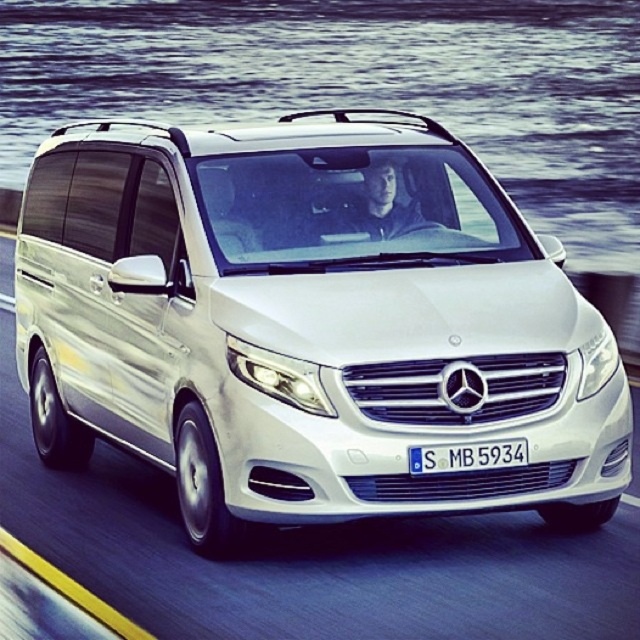
You are a photographer trying to capture both the white metallic van at center and the white matte van at center in a single shot. Since you want them to be clearly visible, you need to know their positions relative to each other. Which van is located to the left of the other?

The white metallic van at center is positioned on the left side of white matte van at center.

You are a photographer standing at the point with coordinates (307, 326) in the scene. What object is exactly at your current position?

The white metallic van at center is exactly at the point with coordinates (307, 326).

You are a driver in the white matte van at center. You notice clear water at center ahead on the road. Is there a risk of hydroplaning? Please explain based on the scene description.

The clear water at center is located above the white matte van at center, meaning it is not on the road but perhaps part of a reflection or a body of water adjacent to the road. Therefore, there is no risk of hydroplaning as the van is driving on the road, not through the water.